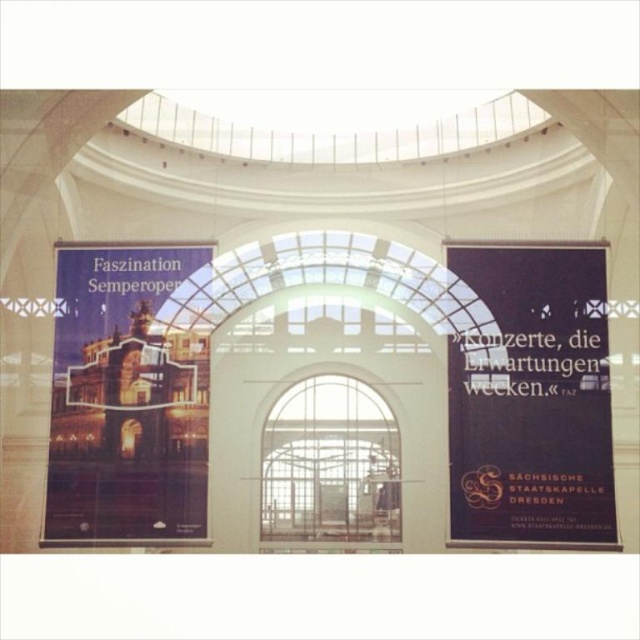
You are standing in the grand hall and want to take a photo of the matte paper poster at left with your camera. Given that the camera has a maximum focus range of 60 meters, will you be able to capture a clear image of the poster?

The matte paper poster at left and camera are 65.42 meters apart, which exceeds the camera maximum focus range of 60 meters. Therefore, you won not be able to capture a clear image of the poster.

You are an interior designer planning to hang a new artwork in this space. You have a choice between placing it to the right of the matte paper poster at left or to the left of the clear glass window at center. Given the spatial constraints, which placement would allow for more space between the new artwork and the existing objects?

Placing the new artwork to the right of the matte paper poster at left would allow for more space since the matte paper poster at left is wider than the clear glass window at center.

You are an event organizer planning to hang two posters in a narrow hallway. The hallway has a width limit of 1.2 meters. You have the black paper poster at right and the matte paper poster at left. Based on the image, can both posters be displayed side by side without exceeding the hallway width?

The black paper poster at right is narrower than the matte paper poster at left. If the combined width of both posters is less than 1.2 meters, they can be displayed side by side. However, without specific measurements, it is impossible to confirm if they fit within the hallway width limit.